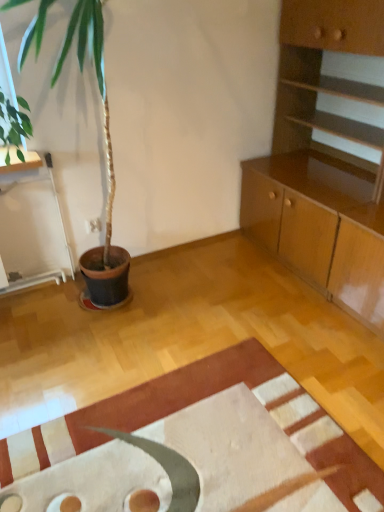
Question: Could you tell me if textured beige rug at center is facing light brown wood cabinet at upper right?

Choices:
 (A) no
 (B) yes

Answer: (A)

Question: Is textured beige rug at center to the right of light brown wood cabinet at upper right from the viewer's perspective?

Choices:
 (A) yes
 (B) no

Answer: (B)

Question: Is textured beige rug at center oriented away from light brown wood cabinet at upper right?

Choices:
 (A) yes
 (B) no

Answer: (B)

Question: Does textured beige rug at center have a greater width compared to light brown wood cabinet at upper right?

Choices:
 (A) yes
 (B) no

Answer: (A)

Question: Is textured beige rug at center far away from light brown wood cabinet at upper right?

Choices:
 (A) yes
 (B) no

Answer: (A)

Question: Is light brown wood cabinet at upper right completely or partially inside textured beige rug at center?

Choices:
 (A) no
 (B) yes

Answer: (A)

Question: From the image's perspective, would you say light brown wood cabinet at upper right is positioned over textured beige rug at center?

Choices:
 (A) no
 (B) yes

Answer: (B)

Question: Are light brown wood cabinet at upper right and textured beige rug at center located far from each other?

Choices:
 (A) yes
 (B) no

Answer: (A)

Question: Does light brown wood cabinet at upper right have a larger size compared to textured beige rug at center?

Choices:
 (A) yes
 (B) no

Answer: (A)

Question: Is light brown wood cabinet at upper right positioned before textured beige rug at center?

Choices:
 (A) yes
 (B) no

Answer: (B)

Question: From the image's perspective, would you say light brown wood cabinet at upper right is shown under textured beige rug at center?

Choices:
 (A) yes
 (B) no

Answer: (B)

Question: Is light brown wood cabinet at upper right turned away from textured beige rug at center?

Choices:
 (A) yes
 (B) no

Answer: (B)

Question: Relative to light brown wood cabinet at upper right, is textured beige rug at center in front or behind?

Choices:
 (A) behind
 (B) front

Answer: (B)